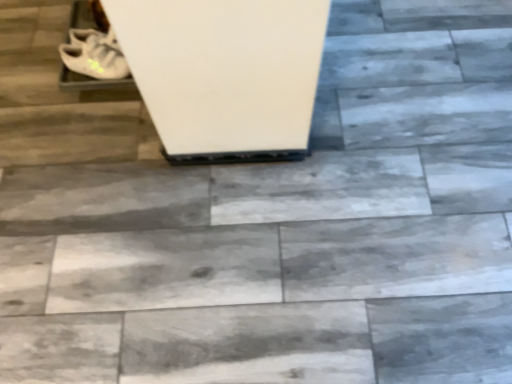
Question: Is white matte shoe at upper left taller or shorter than white matte shoe at upper left?

Choices:
 (A) short
 (B) tall

Answer: (B)

Question: Is white matte shoe at upper left bigger or smaller than white matte shoe at upper left?

Choices:
 (A) small
 (B) big

Answer: (B)

Question: Is white matte shoe at upper left to the left or to the right of white matte shoe at upper left in the image?

Choices:
 (A) left
 (B) right

Answer: (B)

Question: Which is correct: white matte shoe at upper left is inside white matte shoe at upper left, or outside of it?

Choices:
 (A) outside
 (B) inside

Answer: (A)

Question: From the image's perspective, is white matte shoe at upper left located above or below white matte shoe at upper left?

Choices:
 (A) below
 (B) above

Answer: (A)

Question: In terms of size, does white matte shoe at upper left appear bigger or smaller than white matte shoe at upper left?

Choices:
 (A) big
 (B) small

Answer: (B)

Question: Considering their positions, is white matte shoe at upper left located in front of or behind white matte shoe at upper left?

Choices:
 (A) behind
 (B) front

Answer: (B)